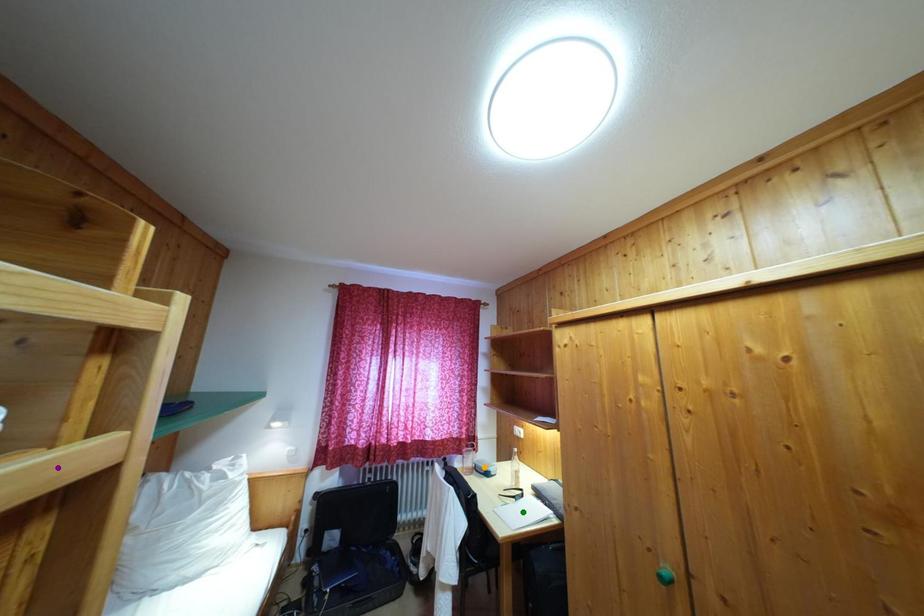
Order these from nearest to farthest:
A) orange point
B) purple point
C) green point

orange point
green point
purple point